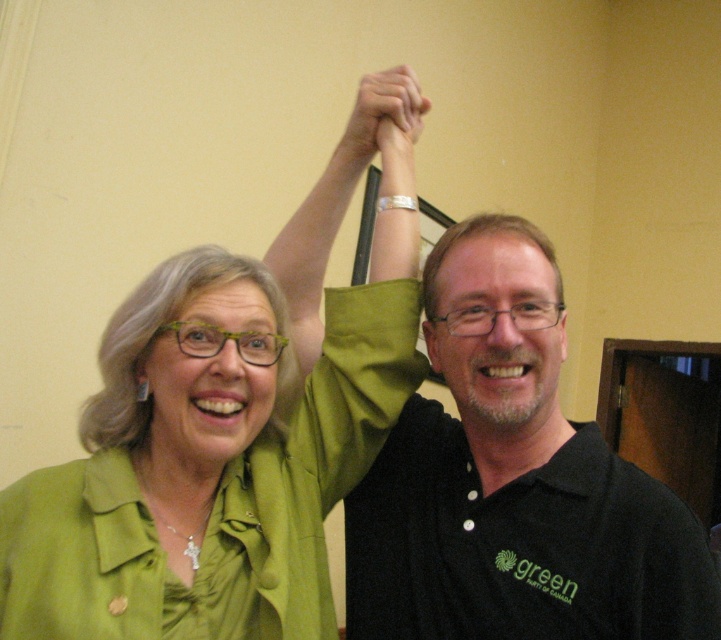
Question: Considering the relative positions of black matte shirt at upper right and matte green hand at center in the image provided, where is black matte shirt at upper right located with respect to matte green hand at center?

Choices:
 (A) right
 (B) left

Answer: (A)

Question: Is green matte jacket at upper left closer to the viewer compared to black matte shirt at upper right?

Choices:
 (A) no
 (B) yes

Answer: (B)

Question: Does green matte jacket at upper left have a smaller size compared to black matte shirt at upper right?

Choices:
 (A) no
 (B) yes

Answer: (A)

Question: Based on their relative distances, which object is farther from the black matte shirt at upper right?

Choices:
 (A) matte green hand at center
 (B) green matte jacket at upper left

Answer: (A)

Question: Which of the following is the farthest from the observer?

Choices:
 (A) (358, 147)
 (B) (398, 563)
 (C) (234, 385)

Answer: (A)

Question: Estimate the real-world distances between objects in this image. Which object is closer to the matte green hand at center?

Choices:
 (A) black matte shirt at upper right
 (B) green matte arm at upper center
 (C) green matte jacket at upper left

Answer: (B)